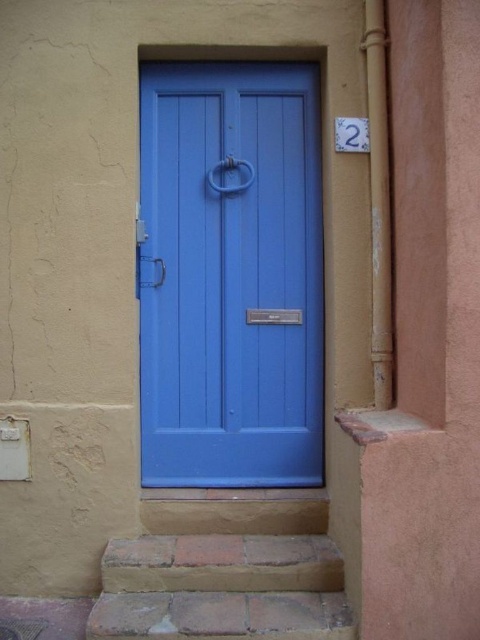
Who is lower down, matte wood door at center or brick/stone stairs at lower center?

Positioned lower is brick/stone stairs at lower center.

Does point (235, 76) lie in front of point (243, 589)?

No, it is not.

Where is `matte wood door at center`? This screenshot has width=480, height=640. matte wood door at center is located at coordinates (230, 275).